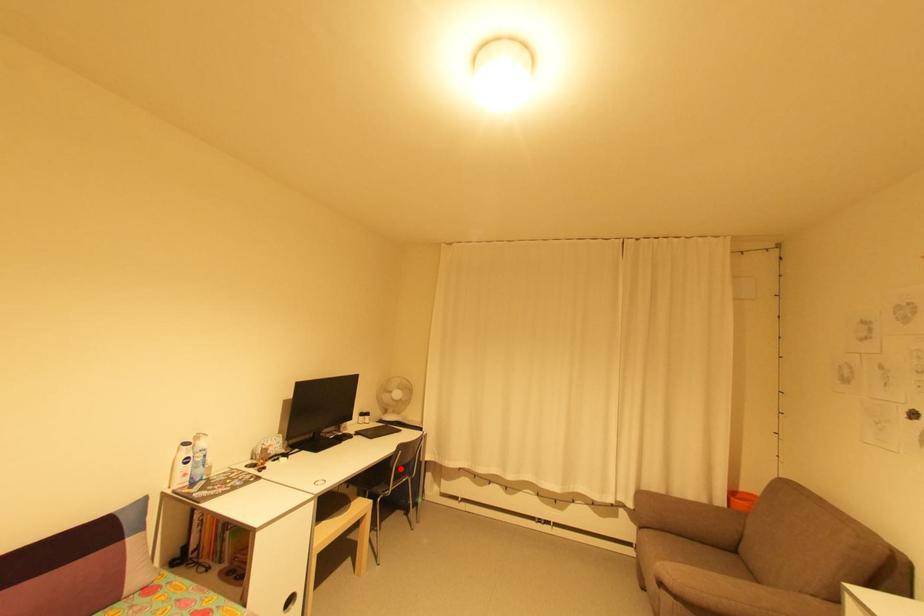
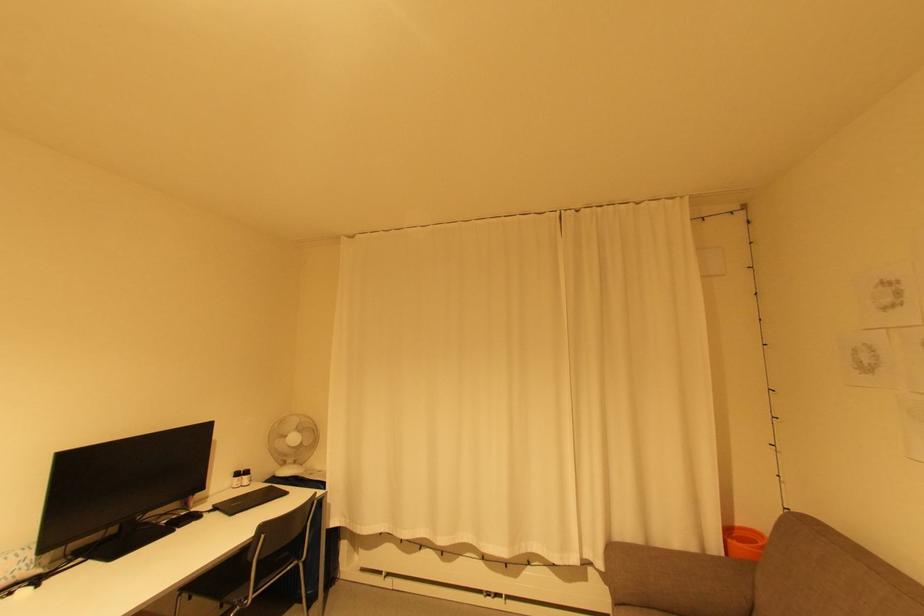
Question: A red point is marked in image1. In image2, is the corresponding 3D point closer to the camera or farther? Reply with the corresponding letter.

Choices:
 (A) The corresponding 3D point is closer.
 (B) The corresponding 3D point is farther.

Answer: (A)